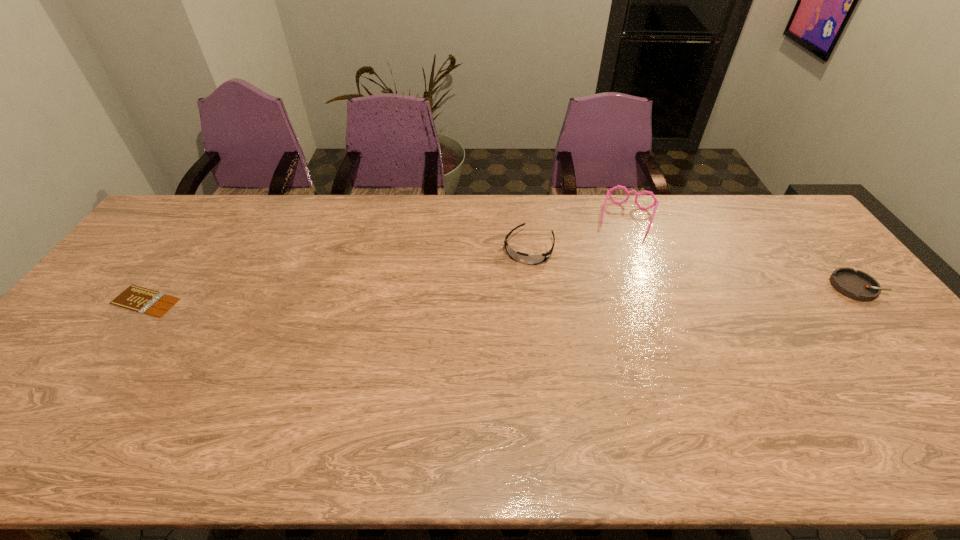
Where is `free space that satisfies the following two spatial constraints: 1. on the back side of the shortest object; 2. on the left side of the sunglasses`? free space that satisfies the following two spatial constraints: 1. on the back side of the shortest object; 2. on the left side of the sunglasses is located at coordinates (184, 248).

At what (x,y) coordinates should I click in order to perform the action: click on vacant position in the image that satisfies the following two spatial constraints: 1. on the back side of the spectacles; 2. on the right side of the third object from right to left. Please return your answer as a coordinate pair (x, y). The height and width of the screenshot is (540, 960). Looking at the image, I should click on (525, 219).